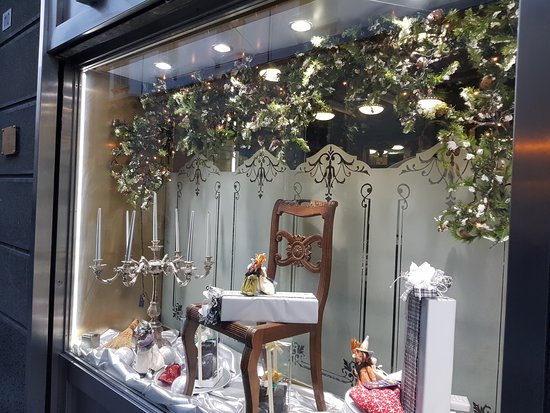
Where is `chair back`? chair back is located at coordinates (291, 252).